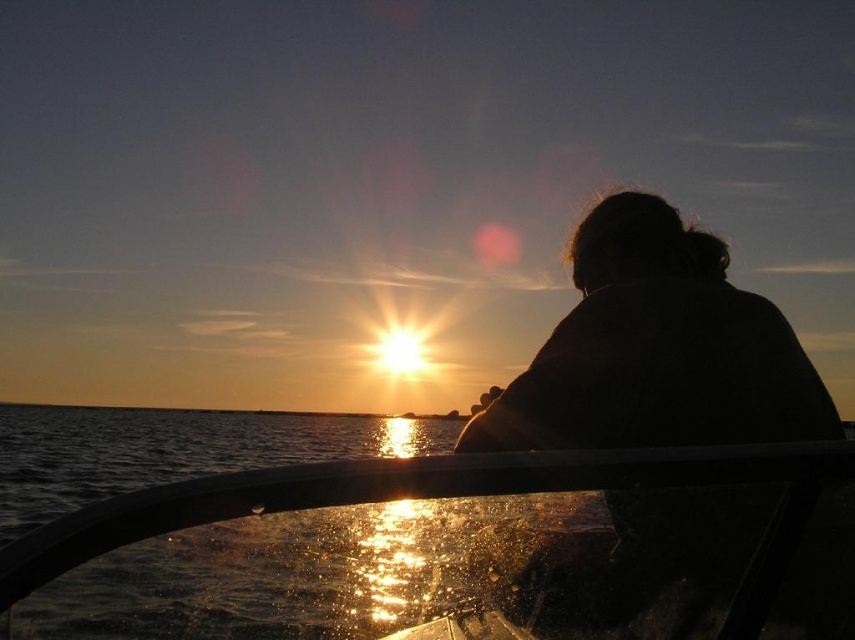
Does silhouette at center have a lesser height compared to transparent glass boat at center?

Yes, silhouette at center is shorter than transparent glass boat at center.

Between silhouette at center and transparent glass boat at center, which one appears on the left side from the viewer's perspective?

From the viewer's perspective, transparent glass boat at center appears more on the left side.

Is point (715, 268) positioned after point (193, 442)?

That is False.

Where is `silhouette at center`? This screenshot has width=855, height=640. silhouette at center is located at coordinates (656, 349).